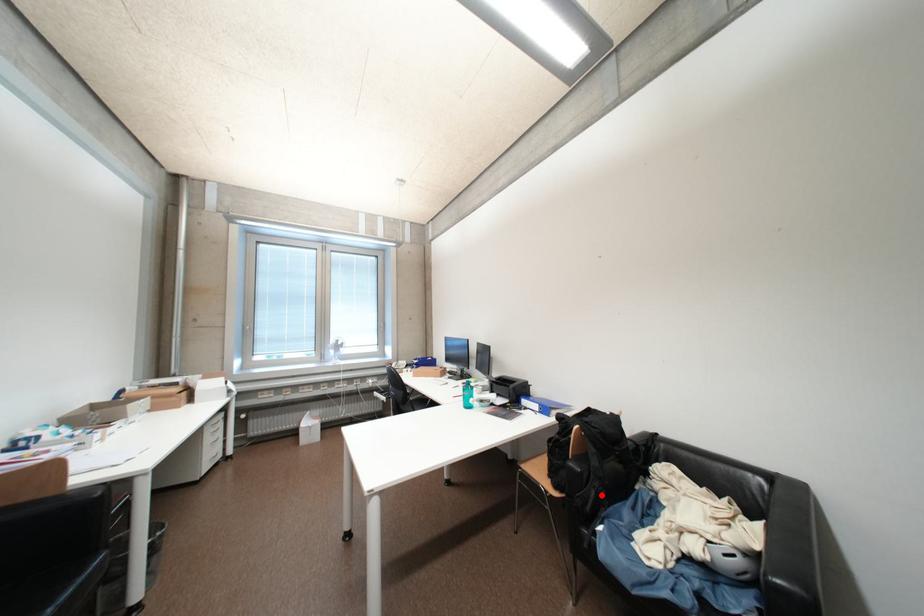
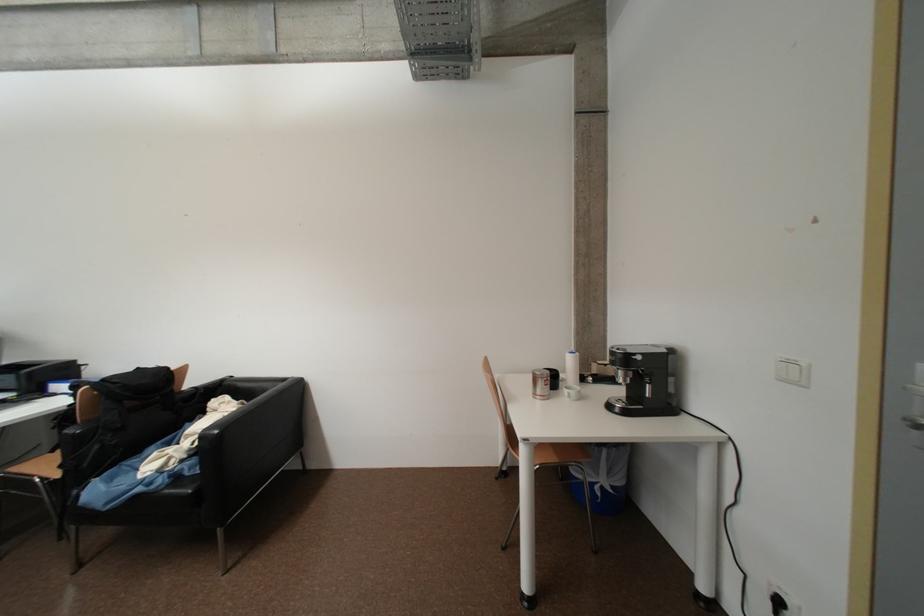
Find the pixel in the second image that matches the highlighted location in the first image.

(104, 448)